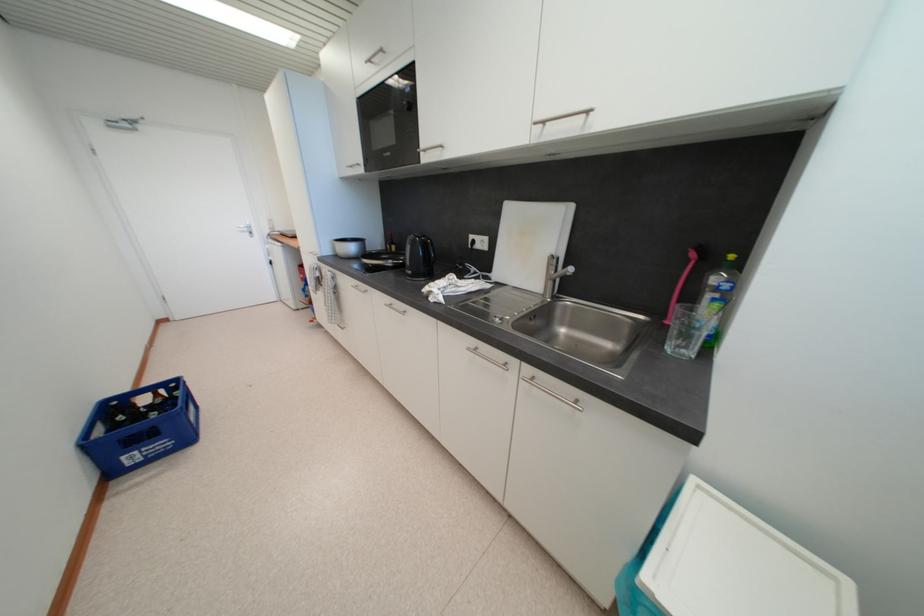
Describe the element at coordinates (142, 442) in the screenshot. The width and height of the screenshot is (924, 616). I see `the blue crate handle` at that location.